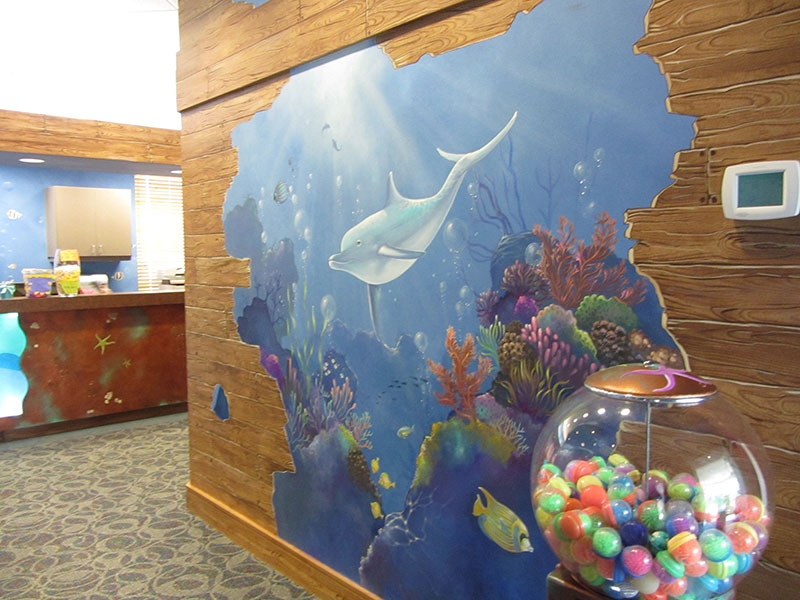
At what (x,y) coordinates should I click in order to perform the action: click on carpet. Please return your answer as a coordinate pair (x, y). This screenshot has width=800, height=600. Looking at the image, I should click on (114, 526).